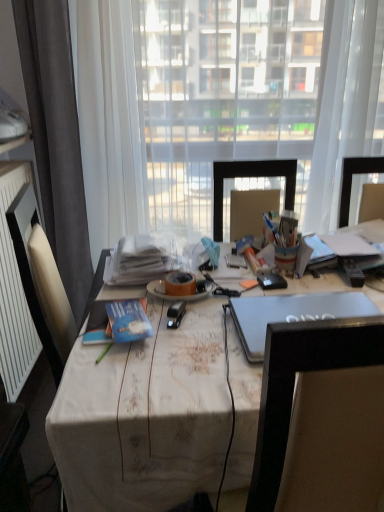
Question: Based on their positions, is blue matte book at center, arranged as the 2th book when viewed from the back, located to the left or right of transparent fabric at center?

Choices:
 (A) left
 (B) right

Answer: (A)

Question: Looking at their shapes, would you say blue matte book at center, placed as the second book when sorted from top to bottom, is wider or thinner than transparent fabric at center?

Choices:
 (A) thin
 (B) wide

Answer: (A)

Question: Which of these objects is positioned closest to the translucent orange adhesive tape at center?

Choices:
 (A) gray fabric curtain at left
 (B) orange matte plate at center
 (C) sleek silver laptop at center
 (D) white paper stack at center, marked as the second book in a bottom-to-top arrangement
 (E) white textured radiator at left

Answer: (B)

Question: Considering the real-world distances, which object is closest to the translucent orange adhesive tape at center?

Choices:
 (A) white textured radiator at left
 (B) orange matte plate at center
 (C) sleek silver laptop at center
 (D) transparent fabric at center
 (E) white paper stack at center, marked as the second book in a bottom-to-top arrangement

Answer: (B)